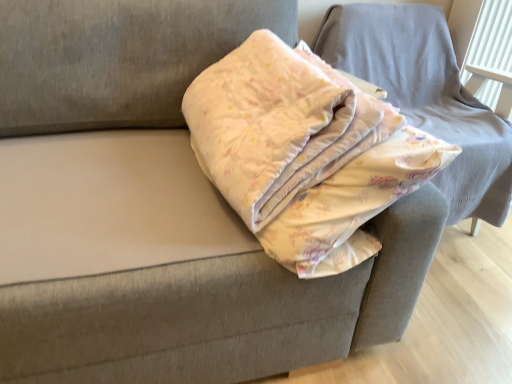
The height and width of the screenshot is (384, 512). I want to click on fluffy cotton blanket at center, so click(x=304, y=153).

Measure the distance between fluffy cotton blanket at center and camera.

The distance of fluffy cotton blanket at center from camera is 31.25 inches.

Describe the element at coordinates (304, 153) in the screenshot. This screenshot has width=512, height=384. I see `fluffy cotton blanket at center` at that location.

What do you see at coordinates (426, 96) in the screenshot?
I see `floral cotton blanket at upper right` at bounding box center [426, 96].

Measure the distance between floral cotton blanket at upper right and camera.

The distance of floral cotton blanket at upper right from camera is 3.76 feet.

Identify the location of floral cotton blanket at upper right. The height and width of the screenshot is (384, 512). (426, 96).

This screenshot has height=384, width=512. I want to click on fluffy cotton blanket at center, so click(304, 153).

In the image, is floral cotton blanket at upper right on the left side or the right side of fluffy cotton blanket at center?

In the image, floral cotton blanket at upper right appears on the right side of fluffy cotton blanket at center.

Is floral cotton blanket at upper right positioned before fluffy cotton blanket at center?

No, it is behind fluffy cotton blanket at center.

Which point is more forward, (477,115) or (324,145)?

The point (324,145) is more forward.

From the image's perspective, is floral cotton blanket at upper right located above or below fluffy cotton blanket at center?

floral cotton blanket at upper right is above fluffy cotton blanket at center.

From a real-world perspective, is floral cotton blanket at upper right physically located above or below fluffy cotton blanket at center?

floral cotton blanket at upper right is situated lower than fluffy cotton blanket at center in the real world.

Considering the relative sizes of floral cotton blanket at upper right and fluffy cotton blanket at center in the image provided, is floral cotton blanket at upper right wider than fluffy cotton blanket at center?

In fact, floral cotton blanket at upper right might be narrower than fluffy cotton blanket at center.

Which of these two, floral cotton blanket at upper right or fluffy cotton blanket at center, stands taller?

With more height is floral cotton blanket at upper right.

Who is bigger, floral cotton blanket at upper right or fluffy cotton blanket at center?

floral cotton blanket at upper right is bigger.

Is floral cotton blanket at upper right outside of fluffy cotton blanket at center?

Yes.

Are floral cotton blanket at upper right and fluffy cotton blanket at center making contact?

No.

Is floral cotton blanket at upper right oriented away from fluffy cotton blanket at center?

No, fluffy cotton blanket at center is not at the back of floral cotton blanket at upper right.

Can you tell me how much floral cotton blanket at upper right and fluffy cotton blanket at center differ in facing direction?

The angle between the facing direction of floral cotton blanket at upper right and the facing direction of fluffy cotton blanket at center is 90.4 degrees.

How much distance is there between floral cotton blanket at upper right and fluffy cotton blanket at center?

54.27 centimeters.

The width and height of the screenshot is (512, 384). In the image, there is a fluffy cotton blanket at center. Identify the location of furniture below it (from a real-world perspective). (426, 96).

Can you confirm if fluffy cotton blanket at center is positioned to the left of floral cotton blanket at upper right?

Indeed, fluffy cotton blanket at center is positioned on the left side of floral cotton blanket at upper right.

Considering the relative positions of fluffy cotton blanket at center and floral cotton blanket at upper right in the image provided, is fluffy cotton blanket at center behind floral cotton blanket at upper right?

No, it is in front of floral cotton blanket at upper right.

Which point is more forward, (266, 121) or (400, 55)?

The point (266, 121) is closer.

From the image's perspective, between fluffy cotton blanket at center and floral cotton blanket at upper right, which one is located above?

Result: floral cotton blanket at upper right.

From a real-world perspective, which is physically above, fluffy cotton blanket at center or floral cotton blanket at upper right?

fluffy cotton blanket at center is physically above.

Between fluffy cotton blanket at center and floral cotton blanket at upper right, which one has larger width?

fluffy cotton blanket at center is wider.

Who is taller, fluffy cotton blanket at center or floral cotton blanket at upper right?

floral cotton blanket at upper right.

Which of these two, fluffy cotton blanket at center or floral cotton blanket at upper right, is bigger?

floral cotton blanket at upper right.

Is fluffy cotton blanket at center located outside floral cotton blanket at upper right?

Yes.

Does fluffy cotton blanket at center touch floral cotton blanket at upper right?

fluffy cotton blanket at center and floral cotton blanket at upper right are clearly separated.

Does fluffy cotton blanket at center turn towards floral cotton blanket at upper right?

No, fluffy cotton blanket at center is not turned towards floral cotton blanket at upper right.

What's the angular difference between fluffy cotton blanket at center and floral cotton blanket at upper right's facing directions?

There is a 90.4-degree angle between the facing directions of fluffy cotton blanket at center and floral cotton blanket at upper right.

This screenshot has height=384, width=512. I want to click on throw pillow lying on the left of floral cotton blanket at upper right, so click(304, 153).

Where is `throw pillow on the left of the floral cotton blanket at upper right`? throw pillow on the left of the floral cotton blanket at upper right is located at coordinates (304, 153).

Image resolution: width=512 pixels, height=384 pixels. Identify the location of furniture below the fluffy cotton blanket at center (from a real-world perspective). [x=426, y=96].